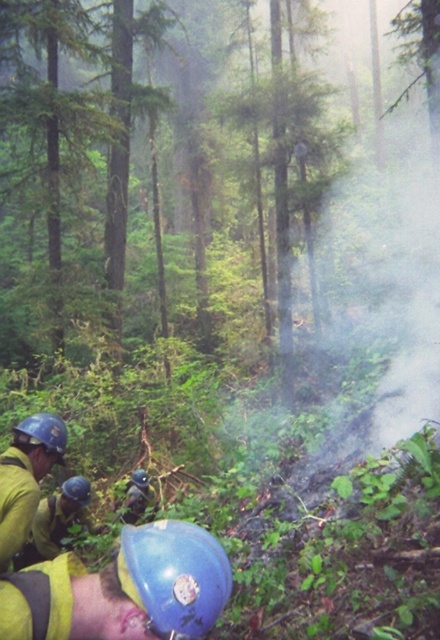
Question: Does blue matte helmet at lower center come behind matte blue helmet at lower center?

Choices:
 (A) yes
 (B) no

Answer: (B)

Question: Which object is the farthest from the yellow fire retardant suit at lower left?

Choices:
 (A) matte blue helmet at lower center
 (B) matte blue helmet at lower left

Answer: (A)

Question: Does yellow fire retardant suit at lower left appear on the right side of blue hard hat at lower left?

Choices:
 (A) no
 (B) yes

Answer: (B)

Question: Among these points, which one is nearest to the camera?

Choices:
 (A) (145, 477)
 (B) (84, 477)
 (C) (121, 579)

Answer: (C)

Question: Which object is positioned closest to the matte blue helmet at lower left?

Choices:
 (A) matte blue helmet at lower center
 (B) blue matte helmet at lower center
 (C) yellow fire retardant suit at lower left
 (D) blue hard hat at lower left

Answer: (A)

Question: Does blue hard hat at lower left have a larger size compared to matte blue helmet at lower left?

Choices:
 (A) yes
 (B) no

Answer: (A)